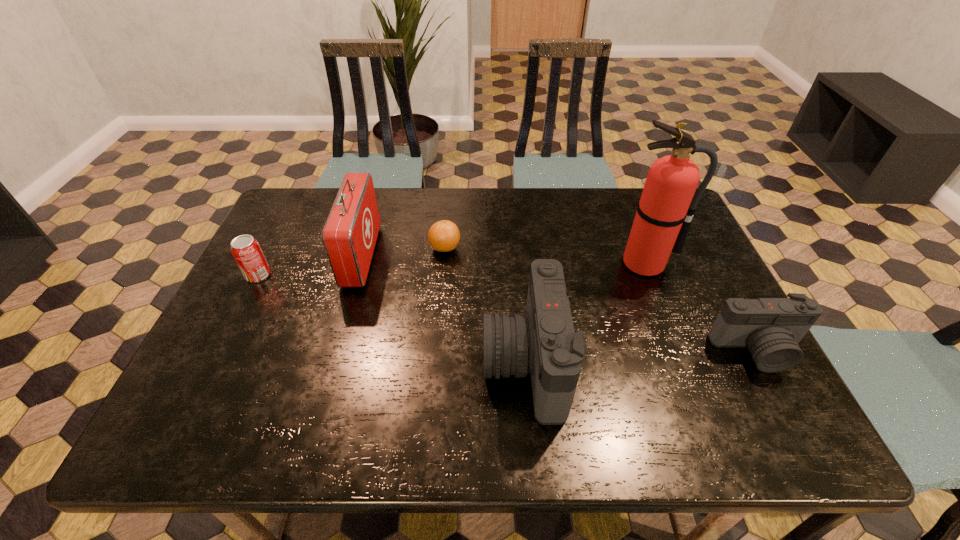
Where is `vacant place for an extra camera on the left`? This screenshot has height=540, width=960. vacant place for an extra camera on the left is located at coordinates click(280, 377).